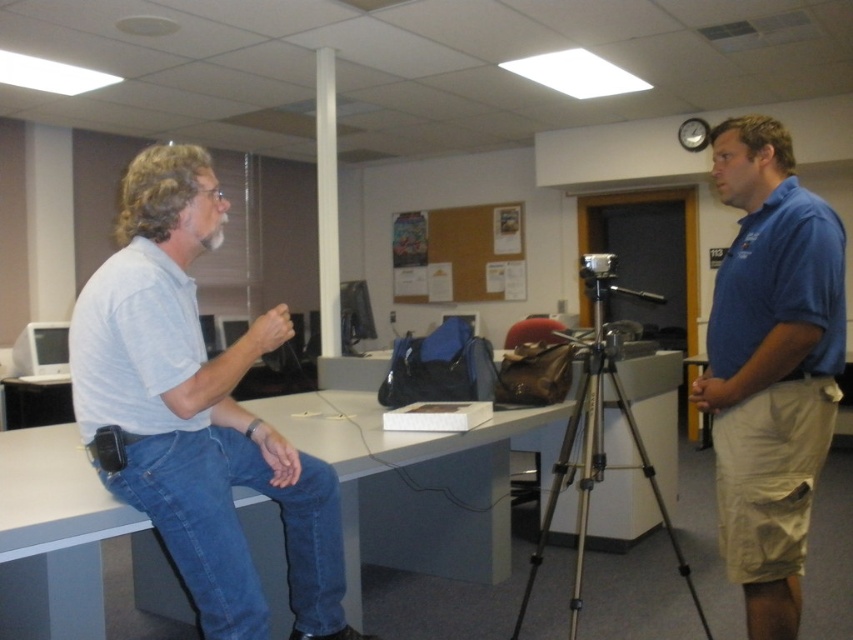
You are standing in the office and need to place a small item on the surface that is lower between the white glossy table at center and the blue cotton shirt at right. Which object should you choose?

The white glossy table at center has a lesser height compared to the blue cotton shirt at right, so you should place the item on the white glossy table at center.

You are organizing a meeting in this office and need to place a name tag on the white glossy table at center. However, there is a person wearing the light gray cotton shirt at left sitting on the table. Can you place the name tag there without moving the person?

The light gray cotton shirt at left is located above the white glossy table at center, meaning the person is sitting on the table. Since the person is occupying the table, you cannot place the name tag there without moving them.

Based on the coordinates provided, what object is located at point (196, 412) in the scene?

The point (196, 412) marks the location of the light gray cotton shirt at left.